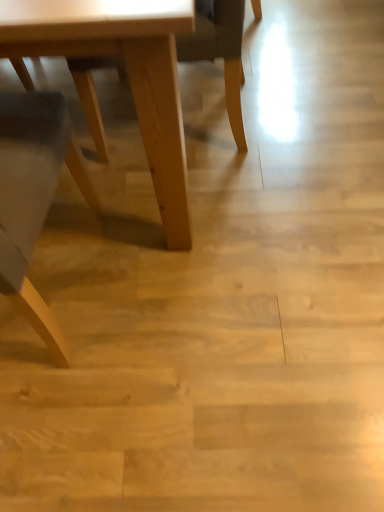
The image size is (384, 512). I want to click on vacant space in front of light wood table at lower left, so 107,394.